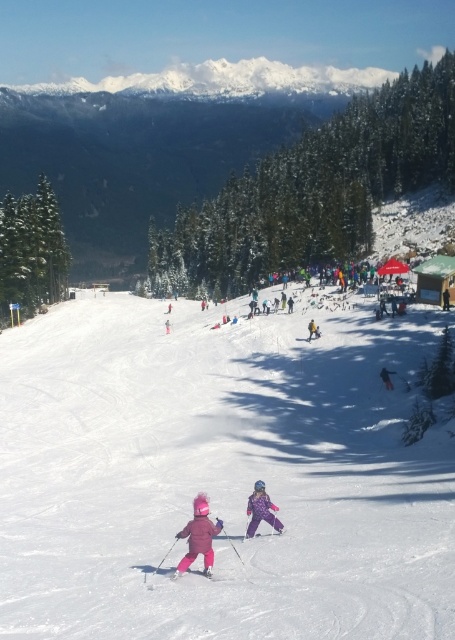
Who is positioned more to the right, white snow ski slope at center or dark blue snowsuit at center?

dark blue snowsuit at center is more to the right.

Is white snow ski slope at center to the left of dark blue snowsuit at center from the viewer's perspective?

Yes, white snow ski slope at center is to the left of dark blue snowsuit at center.

At what (x,y) coordinates should I click in order to perform the action: click on white snow ski slope at center. Please return your answer as a coordinate pair (x, y). The image size is (455, 640). Looking at the image, I should click on point(218,476).

Does point (392, 371) come farther from viewer compared to point (244, 540)?

That is True.

Who is higher up, dark blue snowsuit at center or purple matte ski at center?

dark blue snowsuit at center

Is point (392, 384) positioned after point (254, 531)?

That is True.

The image size is (455, 640). In order to click on dark blue snowsuit at center in this screenshot , I will do `click(387, 378)`.

The height and width of the screenshot is (640, 455). Describe the element at coordinates (218, 476) in the screenshot. I see `white snow ski slope at center` at that location.

Is white snow ski slope at center thinner than purple matte ski at center?

In fact, white snow ski slope at center might be wider than purple matte ski at center.

Who is more forward, (328, 502) or (247, 536)?

Point (247, 536) is in front.

Locate an element on the screen. The image size is (455, 640). white snow ski slope at center is located at coordinates (218, 476).